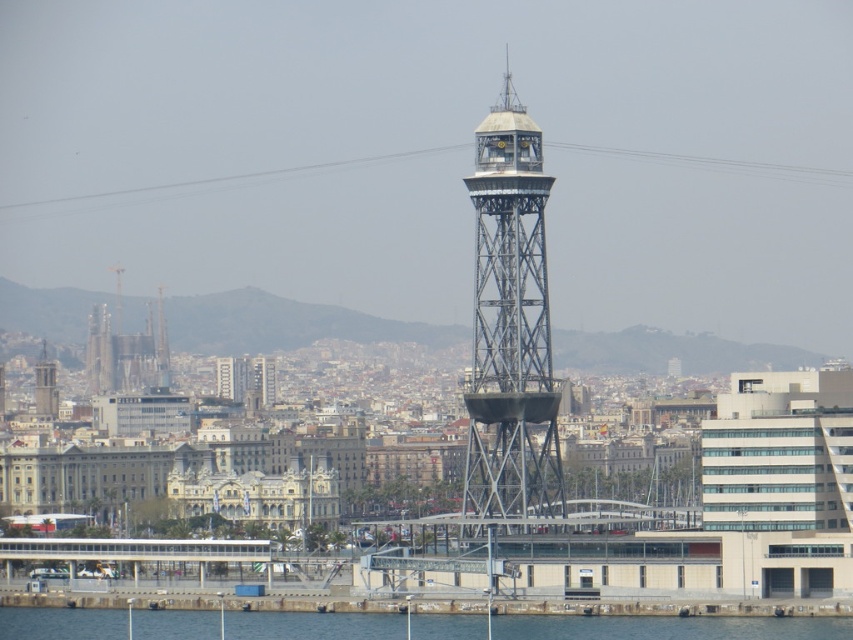
Question: Can you confirm if clear blue water at lower center is positioned below matte gray tower at center?

Choices:
 (A) yes
 (B) no

Answer: (A)

Question: Can you confirm if metallic lattice tower at center is positioned above clear blue water at lower center?

Choices:
 (A) yes
 (B) no

Answer: (A)

Question: Among these objects, which one is nearest to the camera?

Choices:
 (A) matte gray tower at left
 (B) matte gray tower at center
 (C) clear blue water at lower center

Answer: (C)

Question: Which point is closer to the camera?

Choices:
 (A) (33, 372)
 (B) (433, 625)
 (C) (549, 435)
 (D) (107, 385)

Answer: (C)

Question: Considering the relative positions of metallic lattice tower at center and matte gray tower at center in the image provided, where is metallic lattice tower at center located with respect to matte gray tower at center?

Choices:
 (A) above
 (B) below

Answer: (A)

Question: Which point is closer to the camera?

Choices:
 (A) (485, 630)
 (B) (51, 376)

Answer: (A)